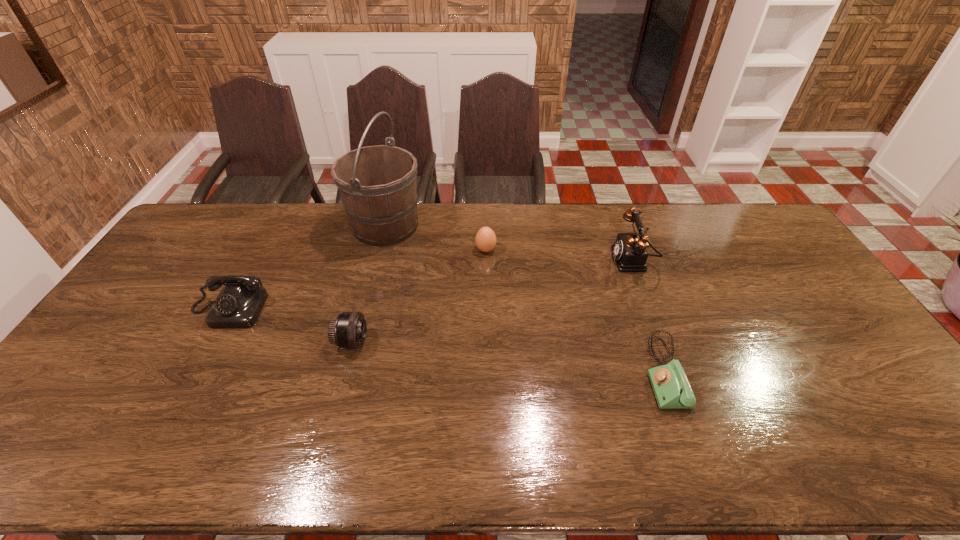
Identify which telephone is the closest to the telephoto lens. Please provide its 2D coordinates. Your answer should be formatted as a tuple, i.e. [(x, y)], where the tuple contains the x and y coordinates of a point satisfying the conditions above.

[(238, 305)]

This screenshot has height=540, width=960. In order to click on vacant space that satisfies the following two spatial constraints: 1. on the front of the tallest telephone at the rotary dial; 2. on the dial of the leftmost telephone in this screenshot , I will do `click(651, 310)`.